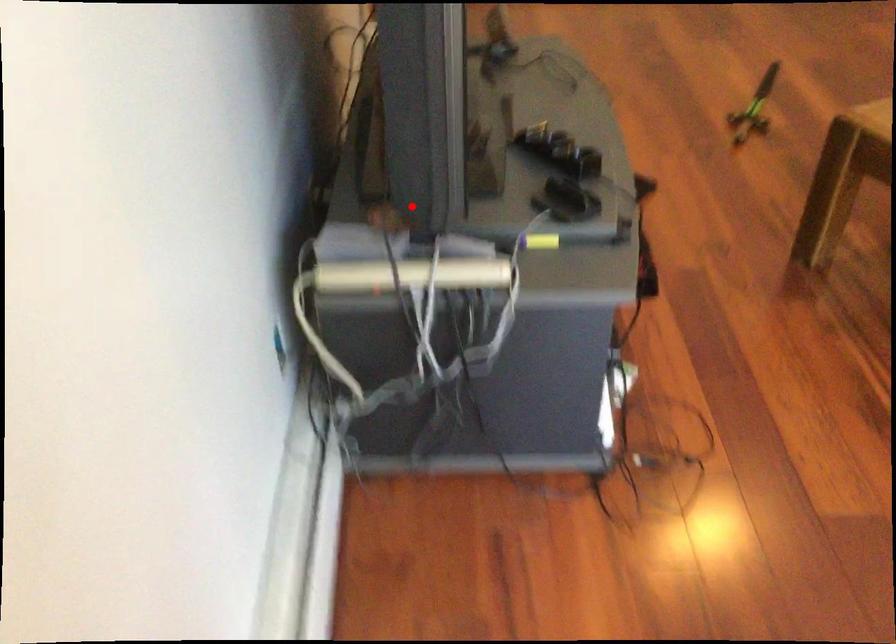
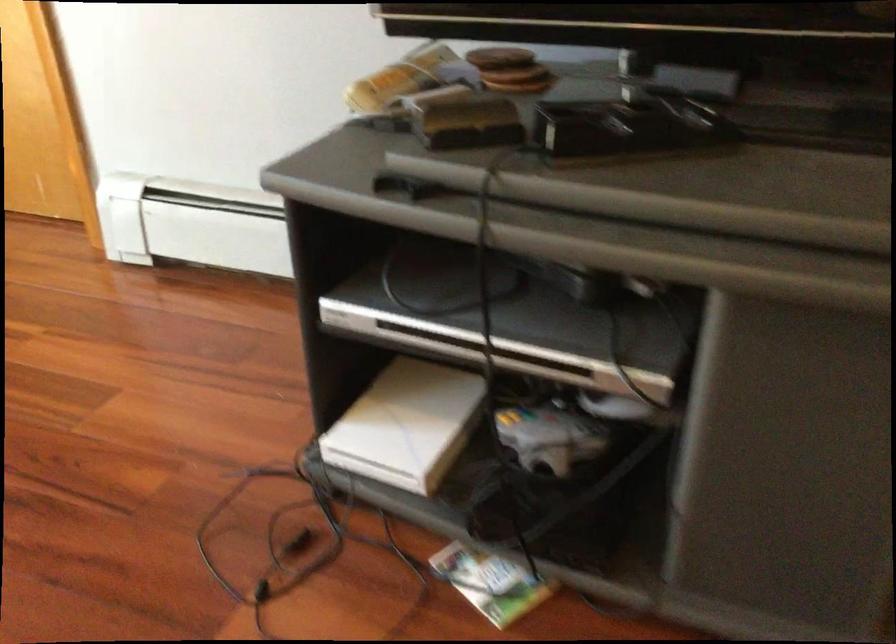
Where in the second image is the point corresponding to the highlighted location from the first image?

(500, 58)